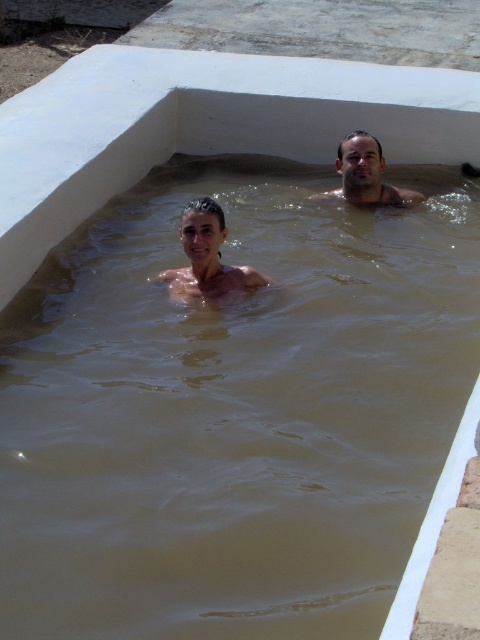
Between smooth skin woman at center and brown skin man at upper right, which one has less height?

brown skin man at upper right is shorter.

Is smooth skin woman at center taller than brown skin man at upper right?

Indeed, smooth skin woman at center has a greater height compared to brown skin man at upper right.

Between point (242, 285) and point (364, 195), which one is positioned in front?

Point (242, 285) is more forward.

This screenshot has width=480, height=640. What are the coordinates of `smooth skin woman at center` in the screenshot? It's located at (207, 257).